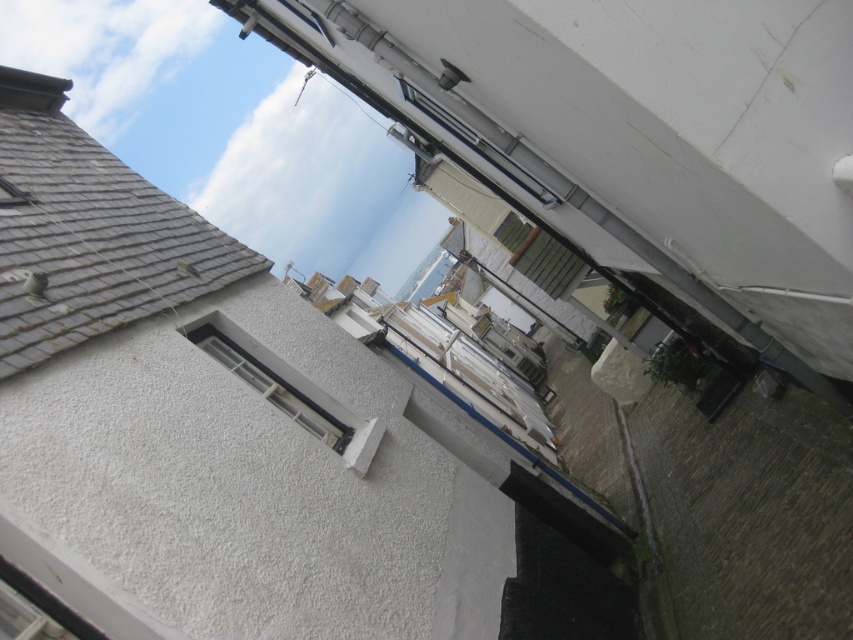
You are standing at the entrance of the alley and want to locate the gray shingles at upper left. According to the coordinate system where the bottom left corner is the origin, which direction should you look to find them?

The gray shingles at upper left are located at coordinate point 0.366 along the x axis and 0.104 along the y axis. Since the y coordinate is lower than the x coordinate, they are positioned higher up and to the left side of the image. From the entrance, you should look towards the upper left direction to locate them.